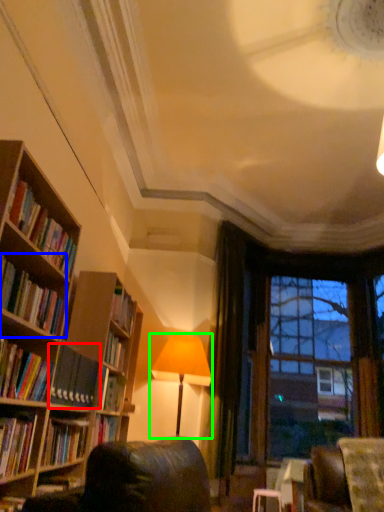
Question: Which object is the farthest from book (highlighted by a red box)? Choose among these: book (highlighted by a blue box) or lamp (highlighted by a green box).

Choices:
 (A) book
 (B) lamp

Answer: (B)